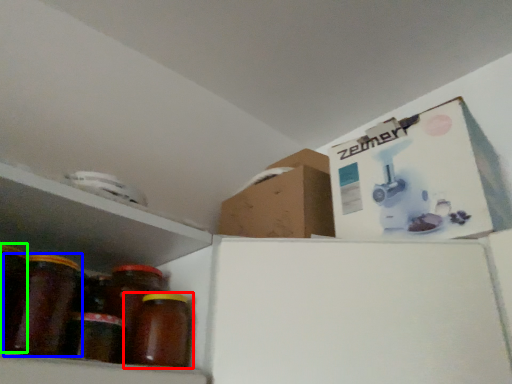
Question: Considering the real-world distances, which object is farthest from bottle (highlighted by a red box)? bottle (highlighted by a blue box) or glass jar (highlighted by a green box)?

Choices:
 (A) bottle
 (B) glass jar

Answer: (B)